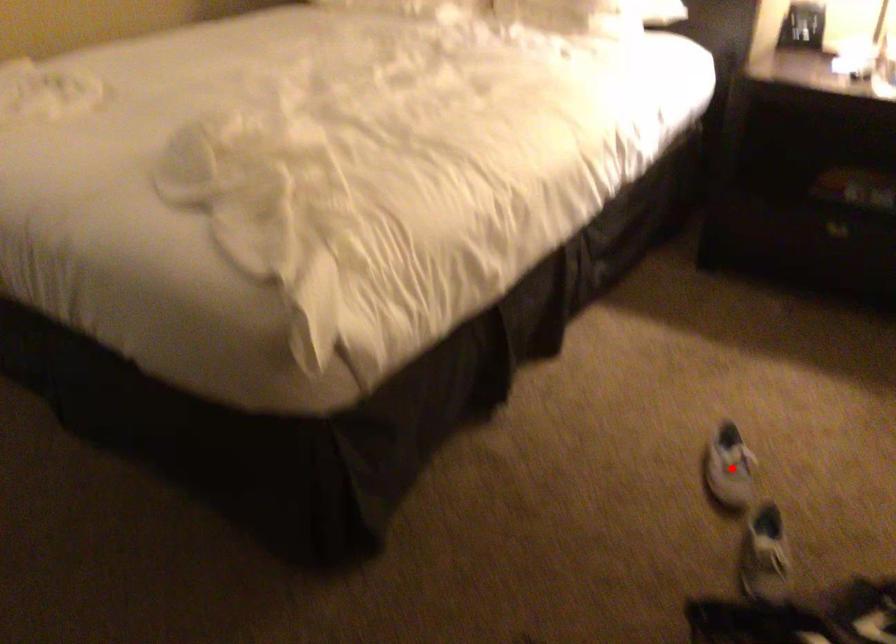
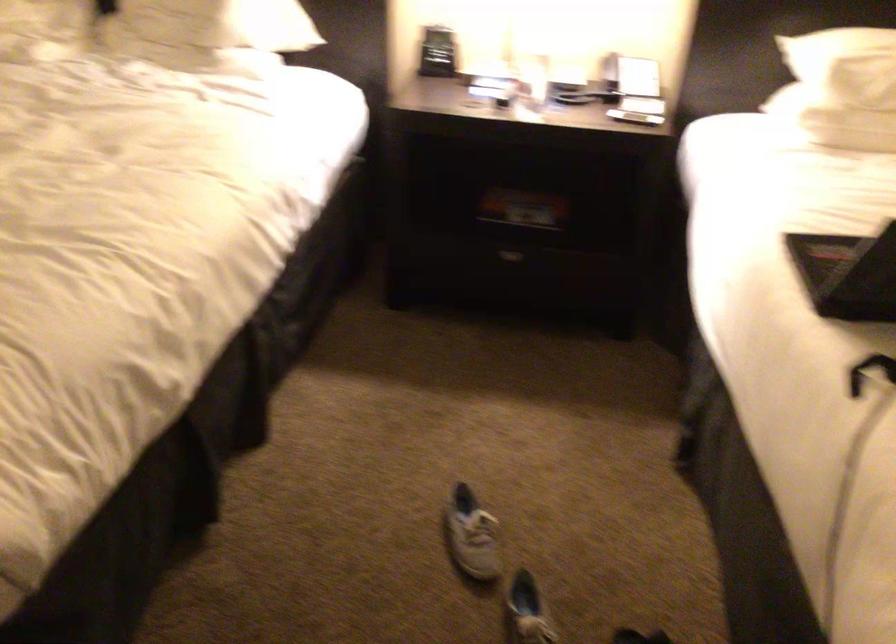
Question: I am providing you with two images of the same scene from different viewpoints. A red point is marked on the first image. At the location where the point appears in image 1, is it still visible in image 2?

Choices:
 (A) Yes
 (B) No

Answer: (A)